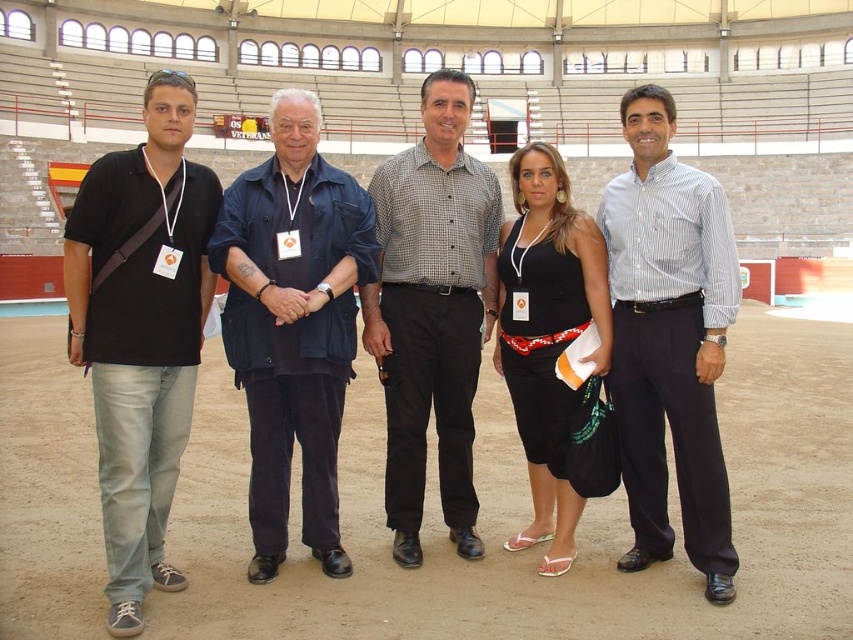
Is matte black shirt at left smaller than white striped shirt at center?

No.

Is matte black shirt at left thinner than white striped shirt at center?

In fact, matte black shirt at left might be wider than white striped shirt at center.

The image size is (853, 640). In order to click on matte black shirt at left in this screenshot , I will do `click(141, 330)`.

Is dark blue cotton shirt at center in front of checkered shirt at center?

Yes, it is in front of checkered shirt at center.

Between point (332, 417) and point (407, 310), which one is positioned behind?

The point (407, 310) is more distant.

The width and height of the screenshot is (853, 640). I want to click on dark blue cotton shirt at center, so click(293, 324).

Who is more distant from viewer, [323,436] or [553,461]?

Point [553,461]

Between dark blue cotton shirt at center and black fabric dress at center, which one appears on the left side from the viewer's perspective?

Positioned to the left is dark blue cotton shirt at center.

Is point (337, 516) farther from viewer compared to point (537, 355)?

No, it is not.

You are a GUI agent. You are given a task and a screenshot of the screen. Output one action in this format:
    pyautogui.click(x=<x>, y=<y>)
    Task: Click on the dark blue cotton shirt at center
    The height and width of the screenshot is (640, 853).
    Given the screenshot: What is the action you would take?
    pyautogui.click(x=293, y=324)